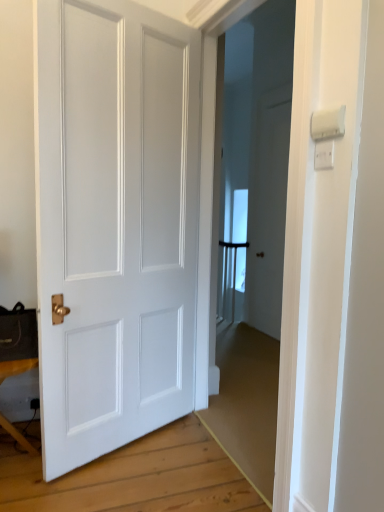
Question: Would you say white plastic light switch at upper right, the first light switch in the bottom-to-top sequence, is inside or outside wooden table at lower left?

Choices:
 (A) outside
 (B) inside

Answer: (A)

Question: Is white plastic light switch at upper right, the first light switch in the bottom-to-top sequence, wider or thinner than wooden table at lower left?

Choices:
 (A) thin
 (B) wide

Answer: (A)

Question: Based on their relative distances, which object is farther from the wooden table at lower left?

Choices:
 (A) white plastic light switch at upper right, placed as the second light switch when sorted from bottom to top
 (B) white matte door at center
 (C) white plastic light switch at upper right, the first light switch in the bottom-to-top sequence

Answer: (A)

Question: Which object is positioned farthest from the white plastic light switch at upper right, placed as the second light switch when sorted from bottom to top?

Choices:
 (A) white plastic light switch at upper right, which is the second light switch in top-to-bottom order
 (B) wooden table at lower left
 (C) white matte door at center

Answer: (B)